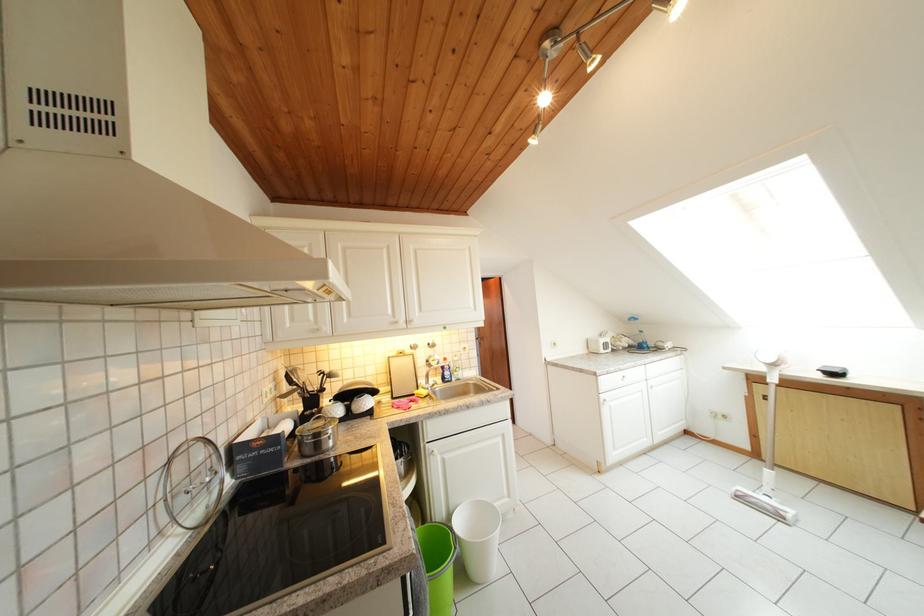
Where is `silver cabinet knob`? This screenshot has width=924, height=616. silver cabinet knob is located at coordinates (337, 326).